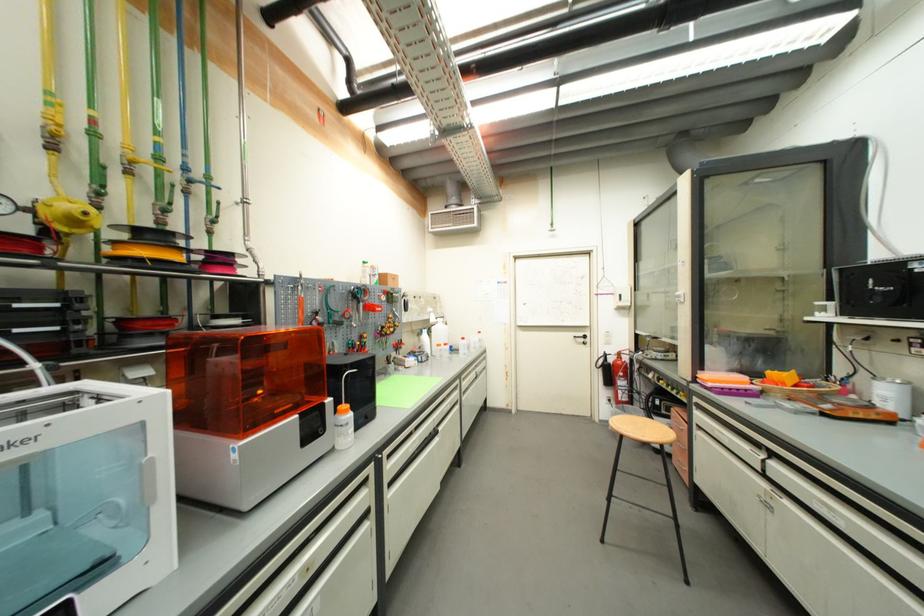
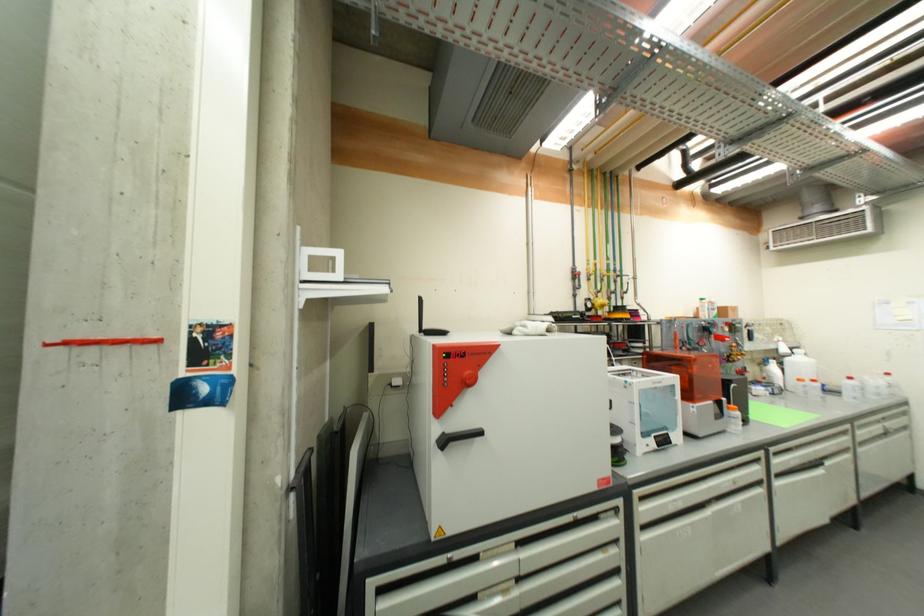
Find the pixel in the second image that matches (x=468, y=339) in the first image.

(856, 379)